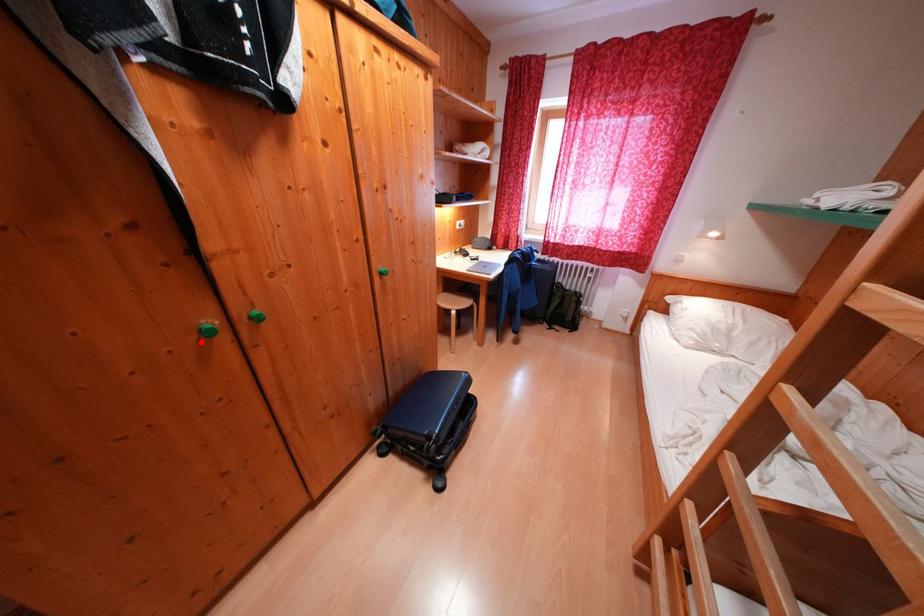
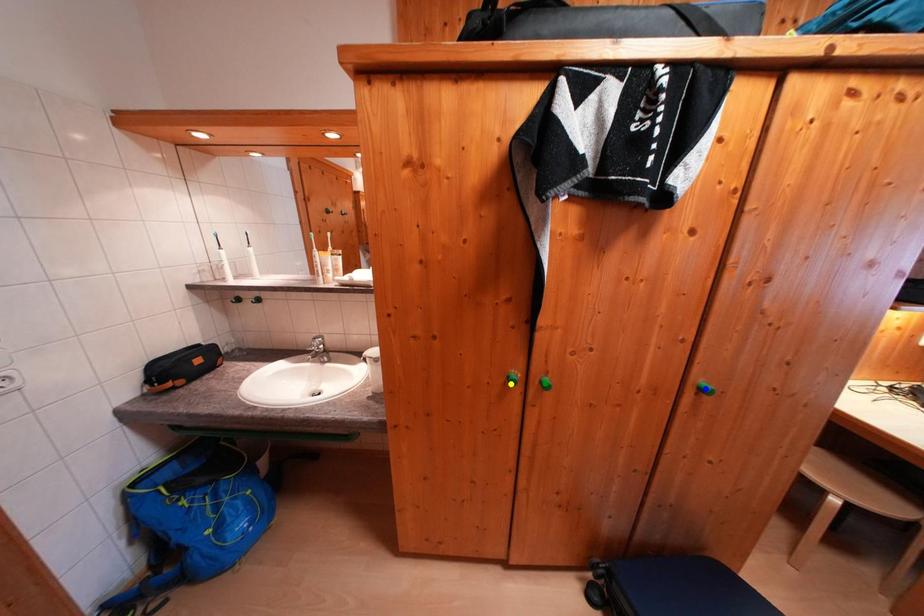
Question: I am providing you with two images of the same scene from different viewpoints. A red point is marked on the first image. You are given multiple points on the second image. Which mark in image 2 goes with the point in image 1?

Choices:
 (A) green point
 (B) yellow point
 (C) blue point

Answer: (B)